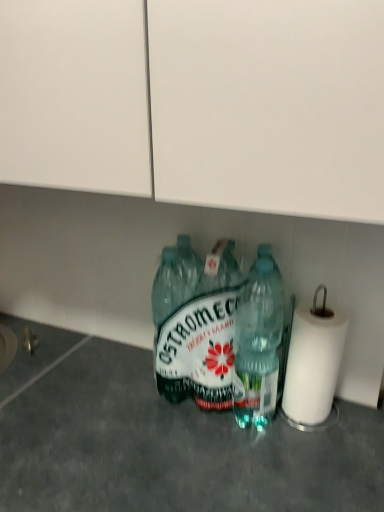
At what (x,y) coordinates should I click in order to perform the action: click on vacant position to the left of white paper at right. Please return your answer as a coordinate pair (x, y). This screenshot has height=512, width=384. Looking at the image, I should click on (222, 445).